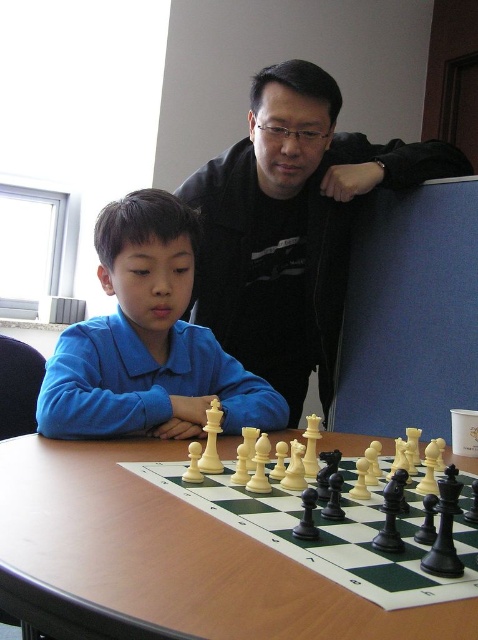
You are a photographer standing at the back of the room. You want to take a photo of both the black matte jacket at upper center and the blue cotton shirt at center in the same frame. Can you position yourself so that both are visible without moving the subjects? Explain using their distance apart.

The black matte jacket at upper center and blue cotton shirt at center are 54.30 centimeters apart. Since they are relatively close to each other, positioning yourself at an angle where both can be captured in the frame should be possible without moving the subjects.

You are standing in front of the wooden table at center and want to place a chess piece that requires 2 inches of space. Can you fit it on the table without moving any existing pieces?

The wooden table at center and viewer are 17.61 inches apart from each other. Since the required space is only 2 inches, the chess piece can easily be placed on the table without moving existing pieces.